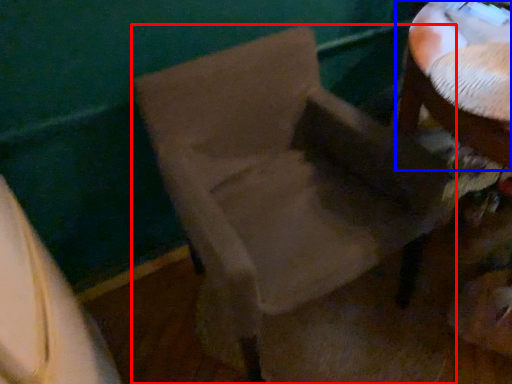
Question: Which object appears closest to the camera in this image, chair (highlighted by a red box) or table (highlighted by a blue box)?

Choices:
 (A) chair
 (B) table

Answer: (A)